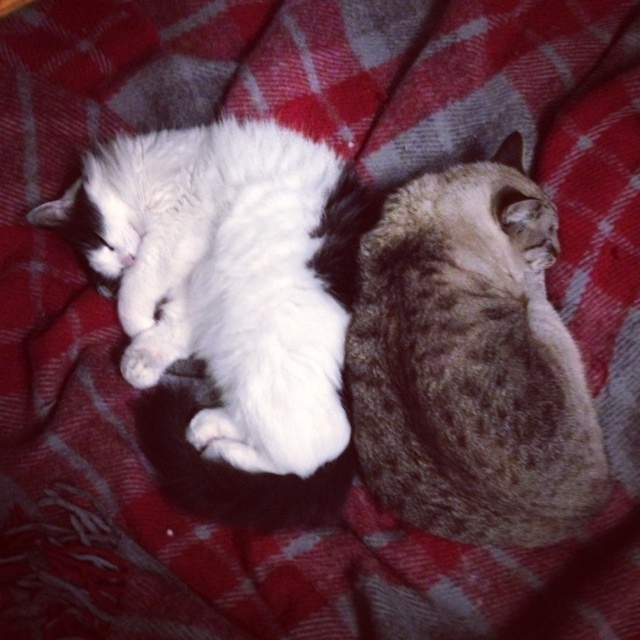
You are a pet sitter and need to place a small heating pad between the gray textured cat at center and the white fluffy cat at upper left. The heating pad is 10 inches long. Will there be enough space between the cats to fit it?

The gray textured cat at center and the white fluffy cat at upper left are 9.17 inches apart from each other. Since the heating pad is 10 inches long, it will not fit between them as the distance is shorter than the pad.

You are a photographer trying to capture a closeup of the gray textured cat at center and the white fluffy cat at upper left. Since you want to focus on both cats equally, which cat should you move closer to the camera to ensure both are in focus?

The gray textured cat at center is positioned on the right side of white fluffy cat at upper left. To focus on both equally, move the white fluffy cat at upper left closer to the camera so that both are at the same distance from the lens.

You are a photographer trying to capture both the gray textured cat at center and the white fluffy cat at upper left in a single frame. Based on their sizes, which cat would require more space in the photo to fully capture its presence?

The white fluffy cat at upper left requires more space in the photo because its width is greater than the gray textured cat at center.